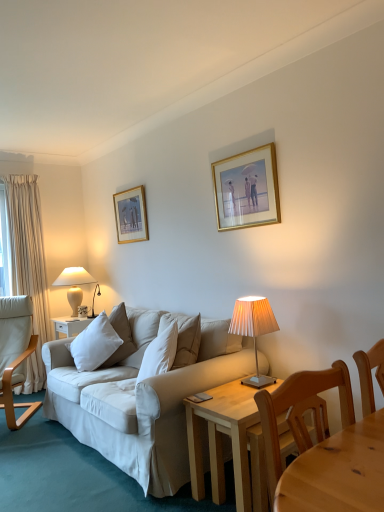
Question: Does light wood table at lower right have a lesser width compared to gold-framed picture at upper center, arranged as the 2th picture frame when viewed from the right?

Choices:
 (A) yes
 (B) no

Answer: (B)

Question: From a real-world perspective, is light wood table at lower right located beneath gold-framed picture at upper center, which is counted as the first picture frame, starting from the left?

Choices:
 (A) no
 (B) yes

Answer: (B)

Question: Is light wood table at lower right at the right side of gold-framed picture at upper center, which is counted as the 1th picture frame, starting from the back?

Choices:
 (A) yes
 (B) no

Answer: (A)

Question: Is light wood table at lower right behind gold-framed picture at upper center, placed as the 2th picture frame when sorted from front to back?

Choices:
 (A) yes
 (B) no

Answer: (B)

Question: Is light wood table at lower right next to gold-framed picture at upper center, which is counted as the 1th picture frame, starting from the back, and touching it?

Choices:
 (A) yes
 (B) no

Answer: (B)

Question: In the image, is white soft pillow at left on the left side or the right side of pleated beige lampshade at center, arranged as the second lamp when viewed from the back?

Choices:
 (A) left
 (B) right

Answer: (A)

Question: From the image's perspective, is white soft pillow at left above or below pleated beige lampshade at center, arranged as the second lamp when viewed from the back?

Choices:
 (A) below
 (B) above

Answer: (A)

Question: In the image, is white soft pillow at left positioned in front of or behind pleated beige lampshade at center, positioned as the second lamp in left-to-right order?

Choices:
 (A) behind
 (B) front

Answer: (A)

Question: Is white soft pillow at left bigger or smaller than pleated beige lampshade at center, arranged as the second lamp when viewed from the back?

Choices:
 (A) small
 (B) big

Answer: (B)

Question: From their relative heights in the image, would you say gold metallic picture frame at upper center, acting as the first picture frame starting from the front, is taller or shorter than white soft pillow at left?

Choices:
 (A) short
 (B) tall

Answer: (B)

Question: Is point (220, 178) closer or farther from the camera than point (94, 326)?

Choices:
 (A) farther
 (B) closer

Answer: (B)

Question: In terms of size, does gold metallic picture frame at upper center, the second picture frame from the back, appear bigger or smaller than white soft pillow at left?

Choices:
 (A) big
 (B) small

Answer: (B)

Question: From the image's perspective, is gold metallic picture frame at upper center, acting as the first picture frame starting from the front, positioned above or below white soft pillow at left?

Choices:
 (A) above
 (B) below

Answer: (A)

Question: Is point (211, 400) positioned closer to the camera than point (77, 307)?

Choices:
 (A) closer
 (B) farther

Answer: (A)

Question: From the image's perspective, relative to white ceramic lamp at left, which ranks as the 1th lamp in left-to-right order, is light wood table at lower right above or below?

Choices:
 (A) below
 (B) above

Answer: (A)